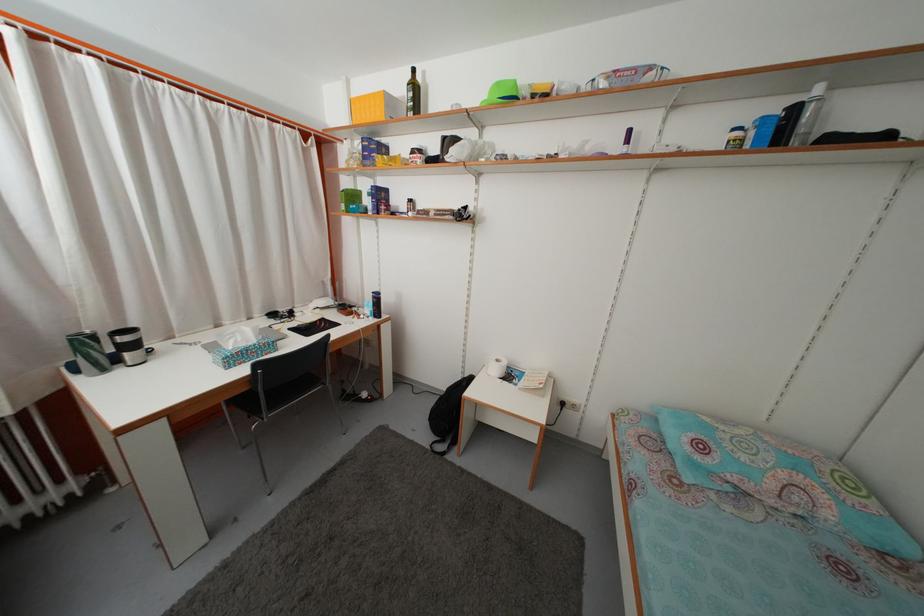
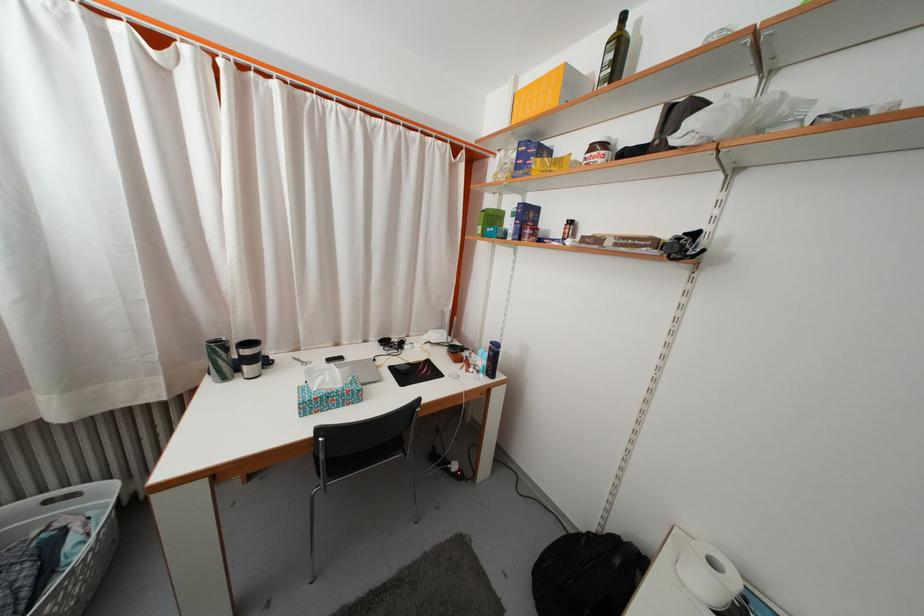
Locate, in the second image, the point that corresponds to pixel 394 108 in the first image.

(575, 84)